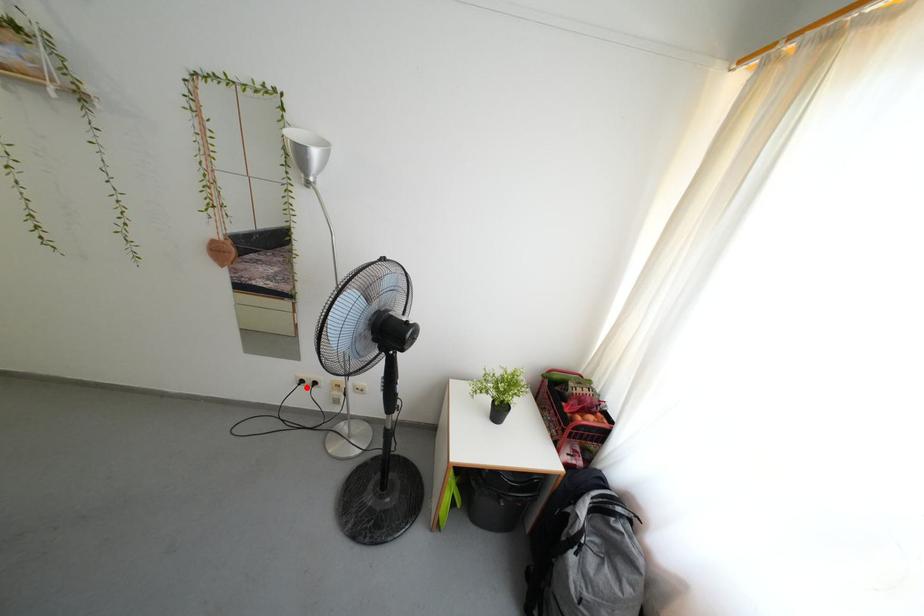
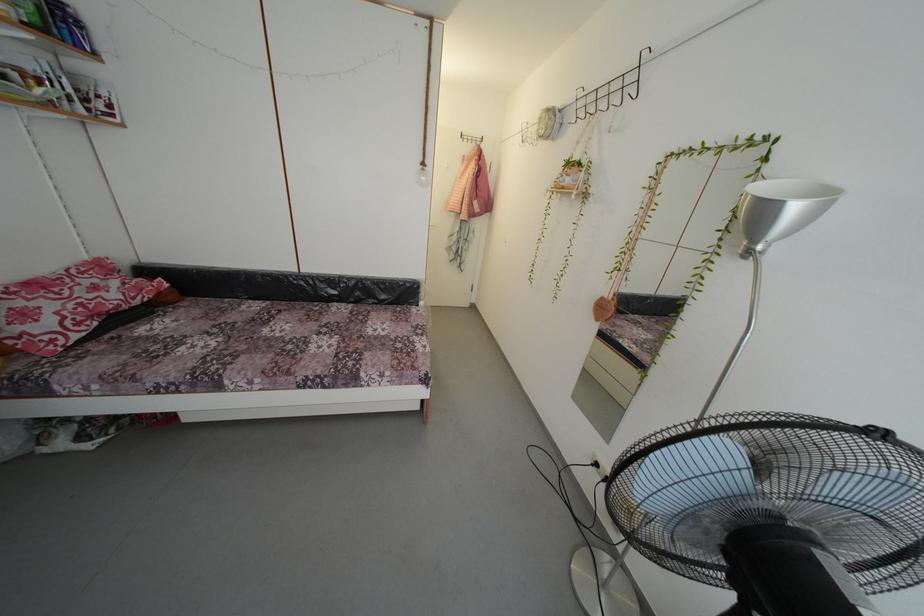
In the second image, find the point that corresponds to the highlighted location in the first image.

(602, 469)